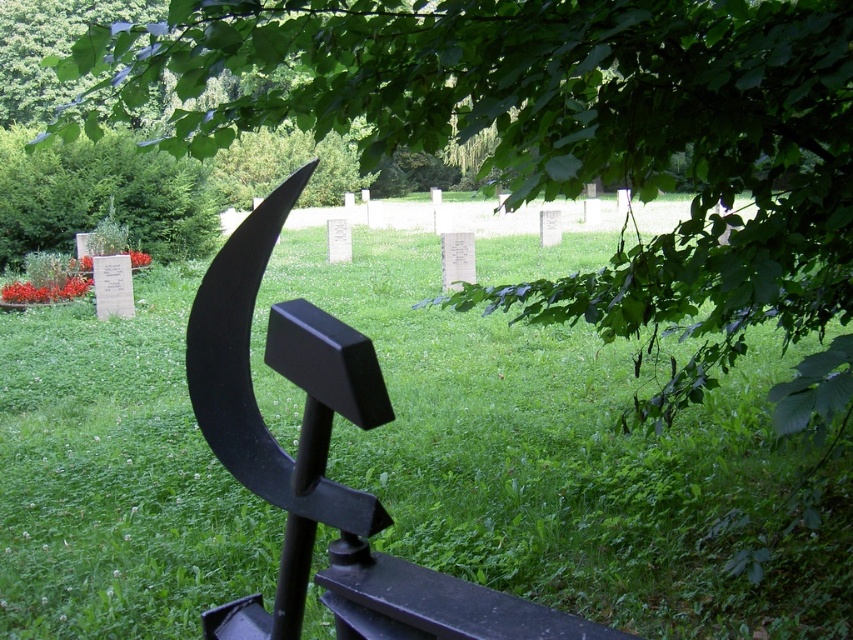
Question: Which of the following is the closest to the observer?

Choices:
 (A) (476, 323)
 (B) (521, 145)

Answer: (B)

Question: Which point is farther from the camera taking this photo?

Choices:
 (A) (456, 433)
 (B) (306, 88)

Answer: (A)

Question: Can you confirm if green grass at center is smaller than green leafy tree at upper left?

Choices:
 (A) yes
 (B) no

Answer: (B)

Question: Does green grass at center appear over green leafy tree at upper left?

Choices:
 (A) yes
 (B) no

Answer: (B)

Question: Considering the relative positions of green grass at center and green leafy tree at upper left in the image provided, where is green grass at center located with respect to green leafy tree at upper left?

Choices:
 (A) below
 (B) above

Answer: (A)

Question: Which point is closer to the camera taking this photo?

Choices:
 (A) (585, 67)
 (B) (207, 509)

Answer: (A)